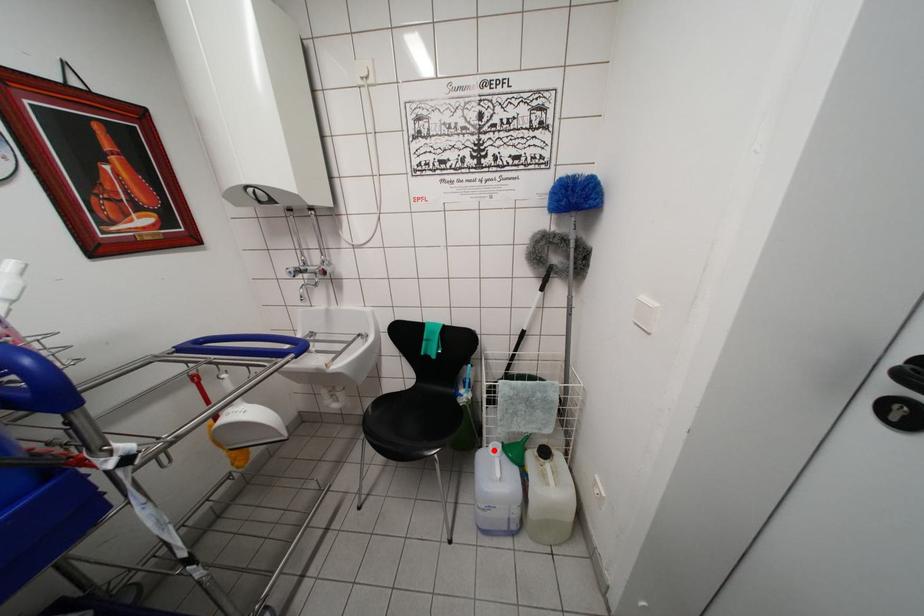
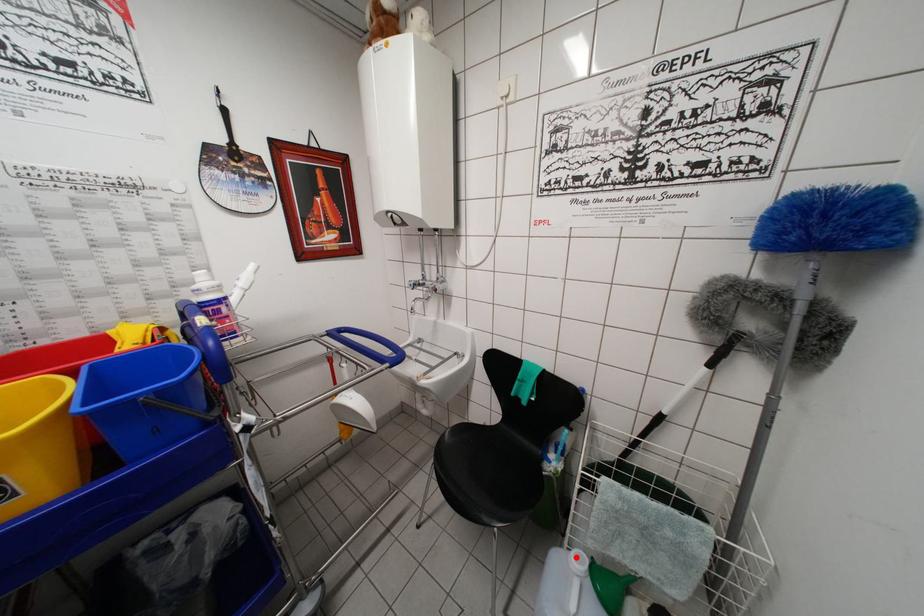
I am providing you with two images of the same scene from different viewpoints. A red point is marked on the first image and another point is marked on the second image. Are the points marked in image1 and image2 representing the same 3D position?

Yes